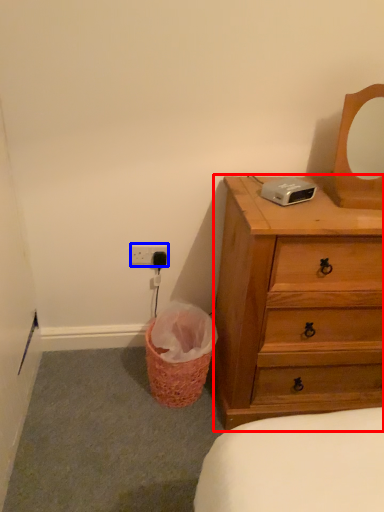
Question: Which of the following is the closest to the observer, chest of drawers (highlighted by a red box) or electric outlet (highlighted by a blue box)?

Choices:
 (A) chest of drawers
 (B) electric outlet

Answer: (A)